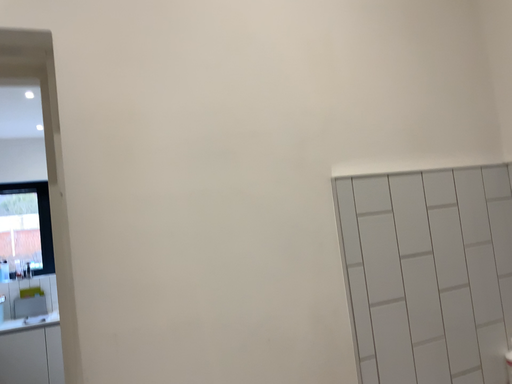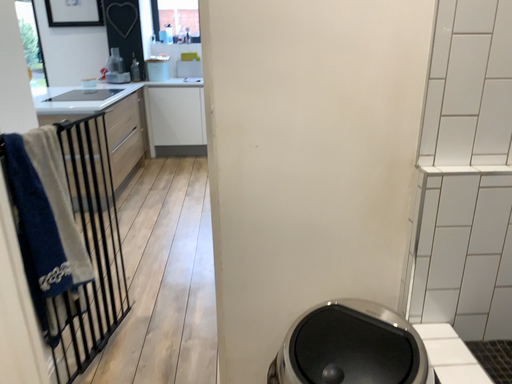
Question: How did the camera likely rotate when shooting the video?

Choices:
 (A) rotated downward
 (B) rotated upward

Answer: (A)